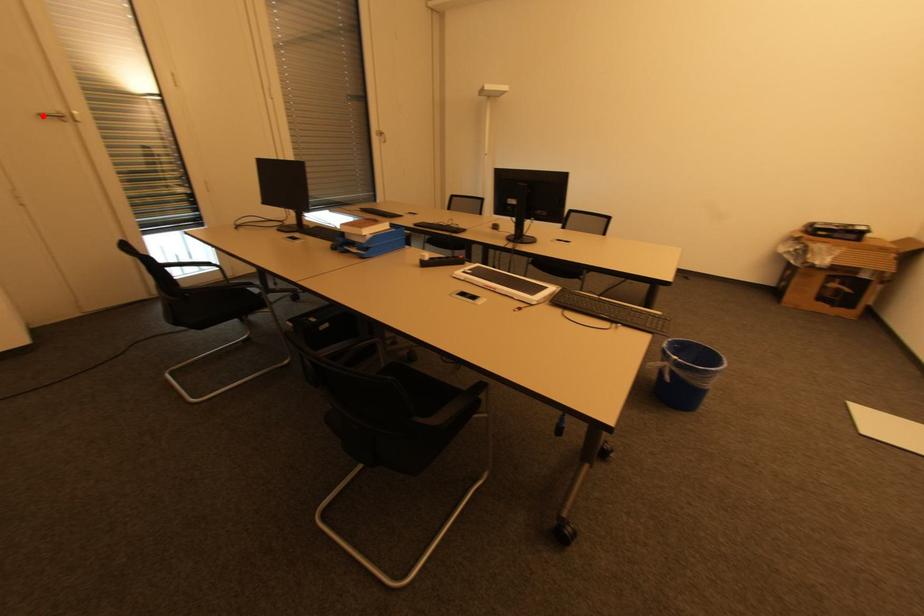
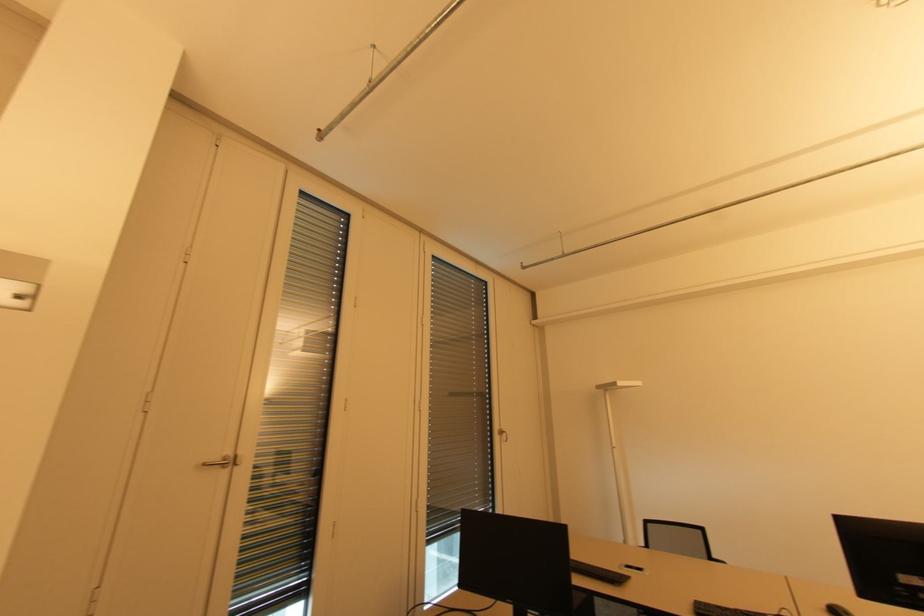
In the second image, find the point that corresponds to the highlighted location in the first image.

(207, 464)